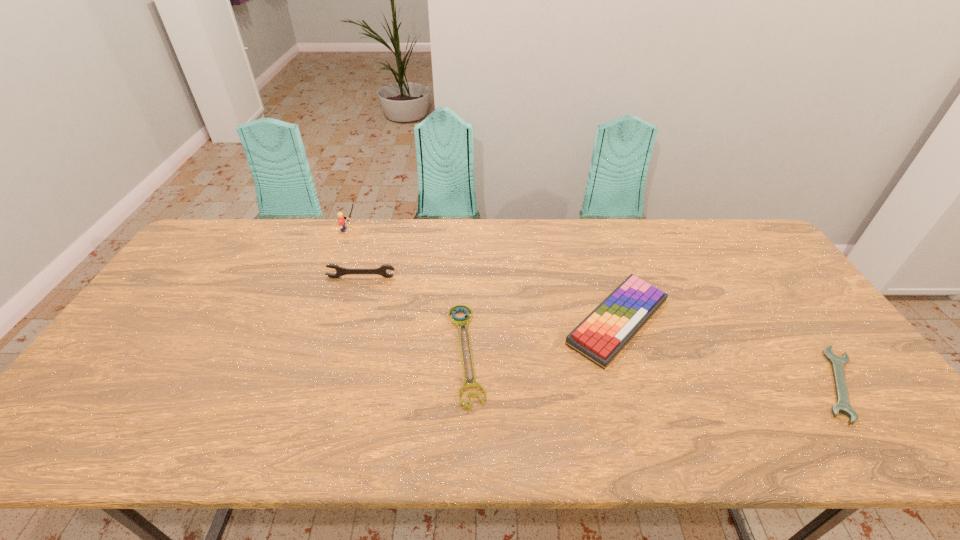
In the image, there is a desktop. Where is `free region at the near left corner`? Image resolution: width=960 pixels, height=540 pixels. free region at the near left corner is located at coordinates (64, 428).

The width and height of the screenshot is (960, 540). In order to click on free location at the far right corner in this screenshot , I will do `click(746, 248)`.

This screenshot has height=540, width=960. Find the location of `free space that is in between the second wrench from left to right and the tallest object`. free space that is in between the second wrench from left to right and the tallest object is located at coordinates (408, 292).

You are a GUI agent. You are given a task and a screenshot of the screen. Output one action in this format:
    pyautogui.click(x=<x>, y=<y>)
    Task: Click on the vacant point located between the third shortest object and the fourth nearest object
    The height and width of the screenshot is (540, 960).
    Given the screenshot: What is the action you would take?
    pyautogui.click(x=490, y=300)

I want to click on vacant space that is in between the third object from left to right and the computer keyboard, so pos(541,338).

This screenshot has height=540, width=960. I want to click on free space between the second wrench from right to left and the farthest object, so click(x=408, y=292).

At what (x,y) coordinates should I click in order to perform the action: click on free area in between the farthest object and the second wrench from left to right. Please return your answer as a coordinate pair (x, y). The width and height of the screenshot is (960, 540). Looking at the image, I should click on (408, 292).

At what (x,y) coordinates should I click in order to perform the action: click on free space between the tallest object and the rightmost wrench. Please return your answer as a coordinate pair (x, y). Looking at the image, I should click on [594, 307].

This screenshot has width=960, height=540. I want to click on unoccupied position between the tallest object and the rightmost wrench, so click(x=594, y=307).

At what (x,y) coordinates should I click in order to perform the action: click on empty space between the third object from left to right and the fourth object from left to right. Please return your answer as a coordinate pair (x, y). Looking at the image, I should click on (541, 338).